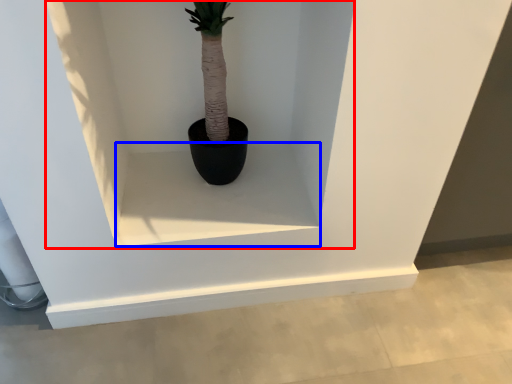
Question: Among these objects, which one is nearest to the camera, shelf (highlighted by a red box) or window sill (highlighted by a blue box)?

Choices:
 (A) shelf
 (B) window sill

Answer: (A)